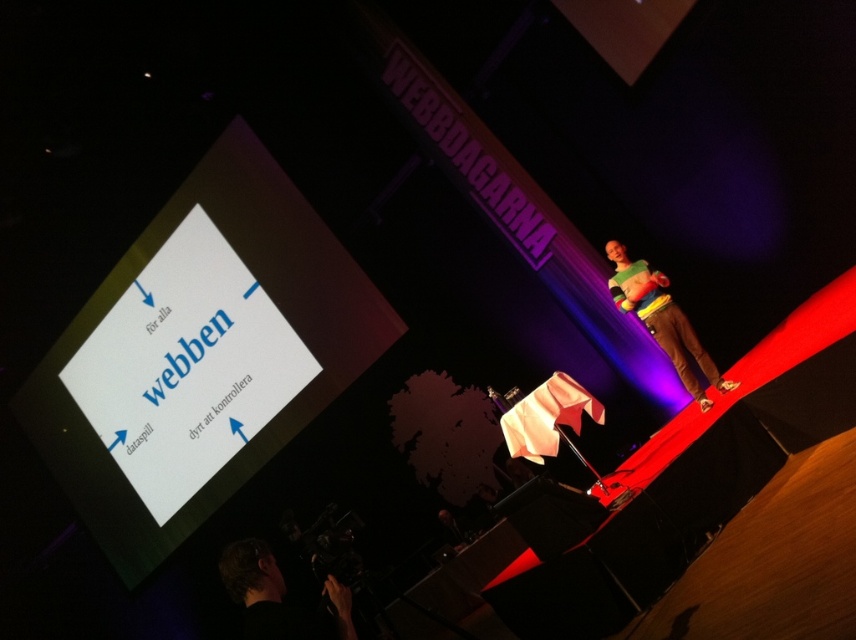
You are an attendee at the conference and need to take a photo of the slide. The black fabric camera at lower left and the multicolored sweater at right are both in your line of sight. Which object is closer to the ground?

The black fabric camera at lower left is closer to the ground since it has a lesser height compared to the multicolored sweater at right.

You are attending a conference and notice a black fabric camera at lower left and a multicolored sweater at right. From the perspective of someone sitting in the front row, which object is positioned lower in the image?

The black fabric camera at lower left is positioned lower than the multicolored sweater at right.